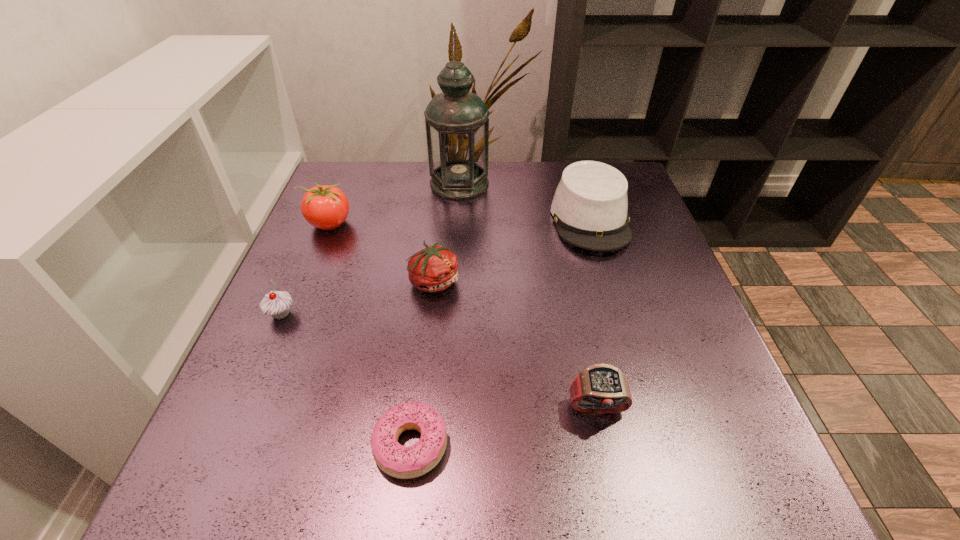
This screenshot has height=540, width=960. I want to click on vacant area in the image that satisfies the following two spatial constraints: 1. on the back side of the oil lamp; 2. on the left side of the taller tomato, so click(346, 184).